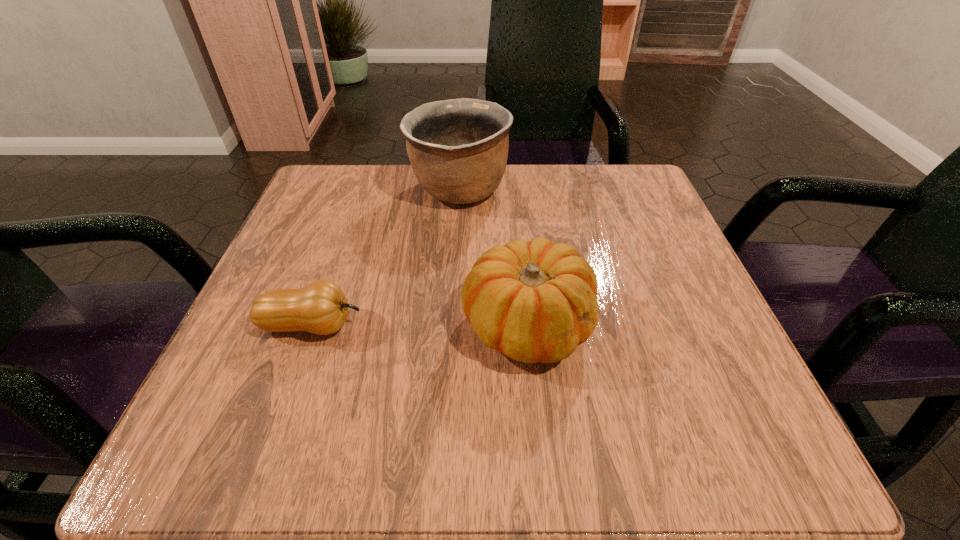
You are a GUI agent. You are given a task and a screenshot of the screen. Output one action in this format:
    pyautogui.click(x=<x>, y=<y>)
    Task: Click on the object that stands as the closest to the farthest object
    The height and width of the screenshot is (540, 960).
    Given the screenshot: What is the action you would take?
    pyautogui.click(x=535, y=301)

Identify the location of free space that satisfies the following two spatial constraints: 1. on the front side of the farthest object; 2. on the stem side of the shorter gourd. (451, 325).